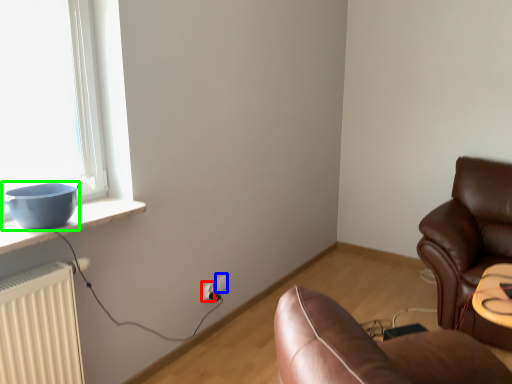
Question: Which object is positioned closest to electric outlet (highlighted by a red box)? Select from electric outlet (highlighted by a blue box) and bowl (highlighted by a green box).

Choices:
 (A) electric outlet
 (B) bowl

Answer: (A)